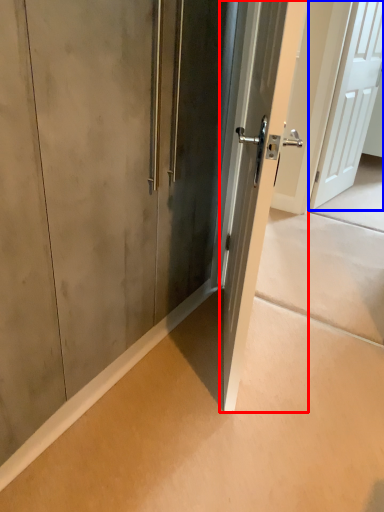
Question: Which object appears farthest to the camera in this image, door (highlighted by a red box) or door (highlighted by a blue box)?

Choices:
 (A) door
 (B) door

Answer: (B)